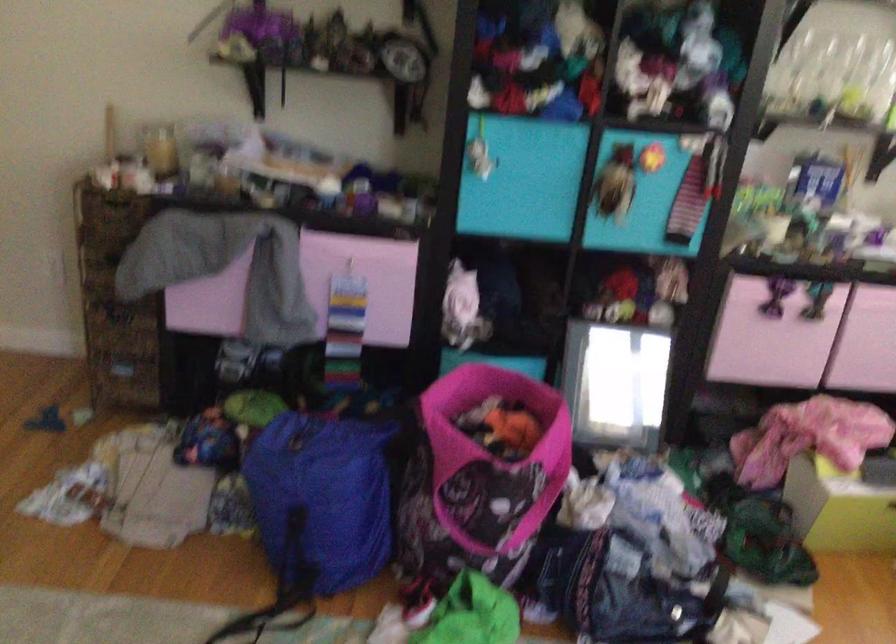
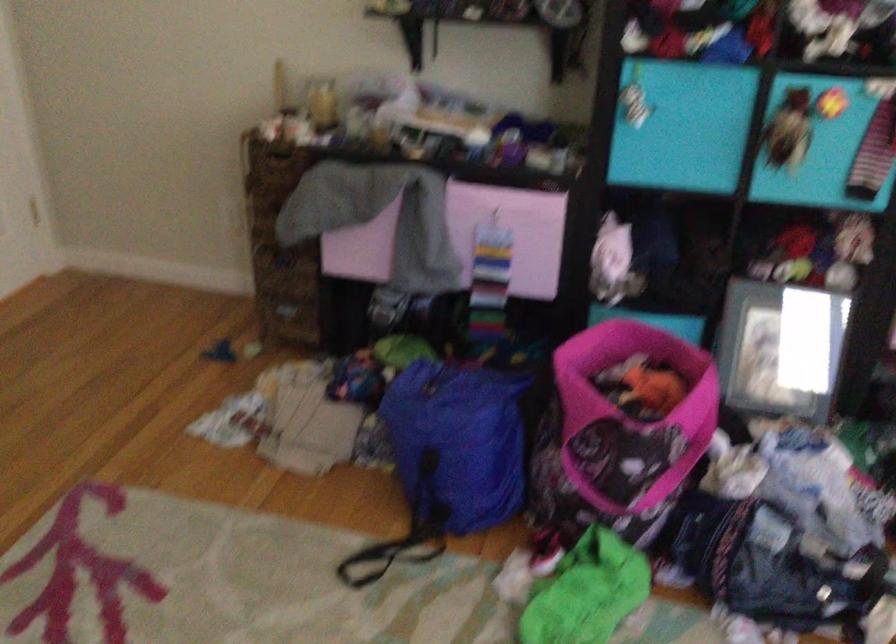
The images are taken continuously from a first-person perspective. In which direction are you moving?

The cameraman moved toward right, forward.